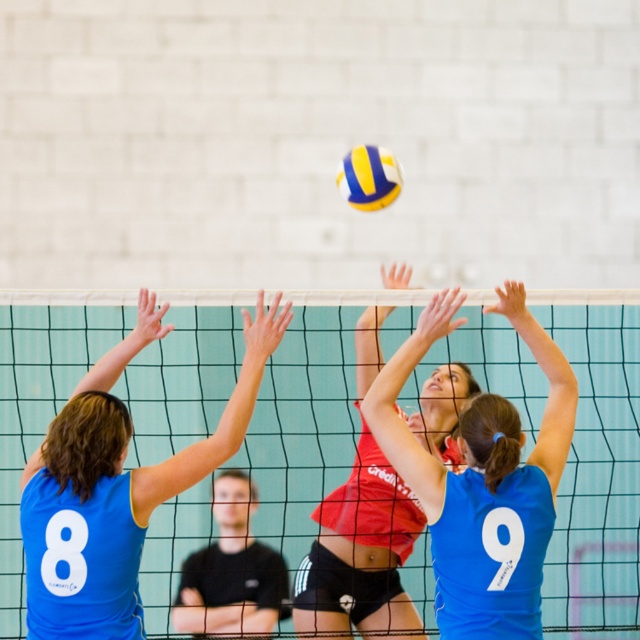
Which of these two, red jersey volleyball player at center or yellowmaterial/texturevolleyball at upper center, stands shorter?

With less height is yellowmaterial/texturevolleyball at upper center.

Which is above, red jersey volleyball player at center or yellowmaterial/texturevolleyball at upper center?

Positioned higher is yellowmaterial/texturevolleyball at upper center.

The width and height of the screenshot is (640, 640). Identify the location of red jersey volleyball player at center. (483, 477).

Can you confirm if green mesh net at center is positioned to the left of yellowmaterial/texturevolleyball at upper center?

In fact, green mesh net at center is to the right of yellowmaterial/texturevolleyball at upper center.

Is point (512, 358) positioned before point (349, 193)?

No, it is not.

Does point (637, 616) lie behind point (396, 173)?

Yes, point (637, 616) is farther from viewer.

This screenshot has width=640, height=640. Find the location of `green mesh net at center`. green mesh net at center is located at coordinates (596, 468).

Is red jersey at center to the right of yellowmaterial/texturevolleyball at upper center from the viewer's perspective?

Correct, you'll find red jersey at center to the right of yellowmaterial/texturevolleyball at upper center.

I want to click on red jersey at center, so click(360, 554).

Is point (420, 403) more distant than point (390, 156)?

No, (420, 403) is in front of (390, 156).

In order to click on red jersey at center in this screenshot , I will do `click(360, 554)`.